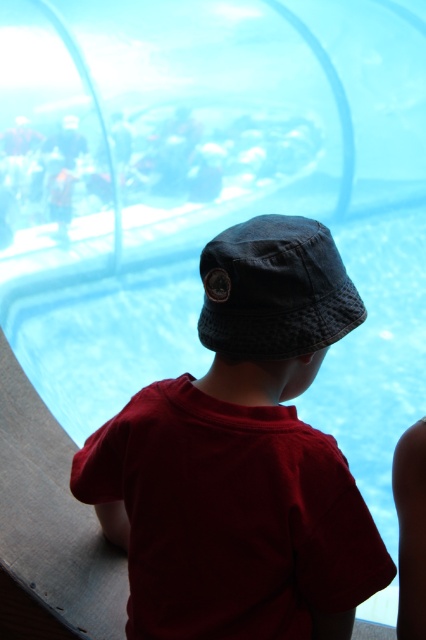
Who is lower down, dark blue fabric hat at center or denim baseball hat at center?

Positioned lower is dark blue fabric hat at center.

Is point (316, 552) farther from viewer compared to point (290, 225)?

No, (316, 552) is closer to viewer.

Identify the location of dark blue fabric hat at center. The height and width of the screenshot is (640, 426). (241, 458).